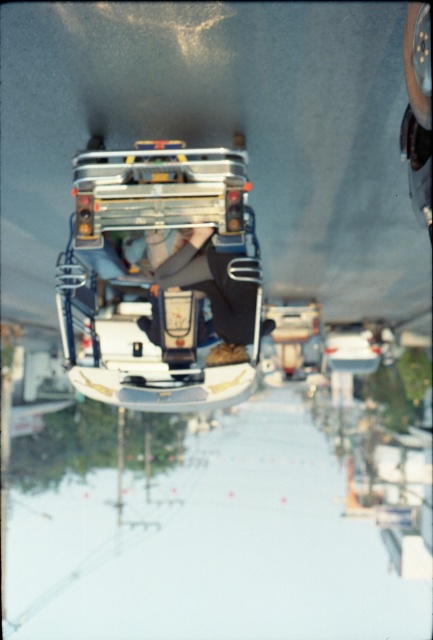
Question: Does metallic silver ski lift at center have a greater width compared to leather black pants at center?

Choices:
 (A) no
 (B) yes

Answer: (B)

Question: Among these objects, which one is farthest from the camera?

Choices:
 (A) leather black pants at center
 (B) metallic silver ski lift at center

Answer: (A)

Question: Does metallic silver ski lift at center appear on the right side of leather black pants at center?

Choices:
 (A) no
 (B) yes

Answer: (A)

Question: Does metallic silver ski lift at center lie in front of leather black pants at center?

Choices:
 (A) no
 (B) yes

Answer: (B)

Question: Which of the following is the farthest from the observer?

Choices:
 (A) (199, 269)
 (B) (186, 372)

Answer: (A)